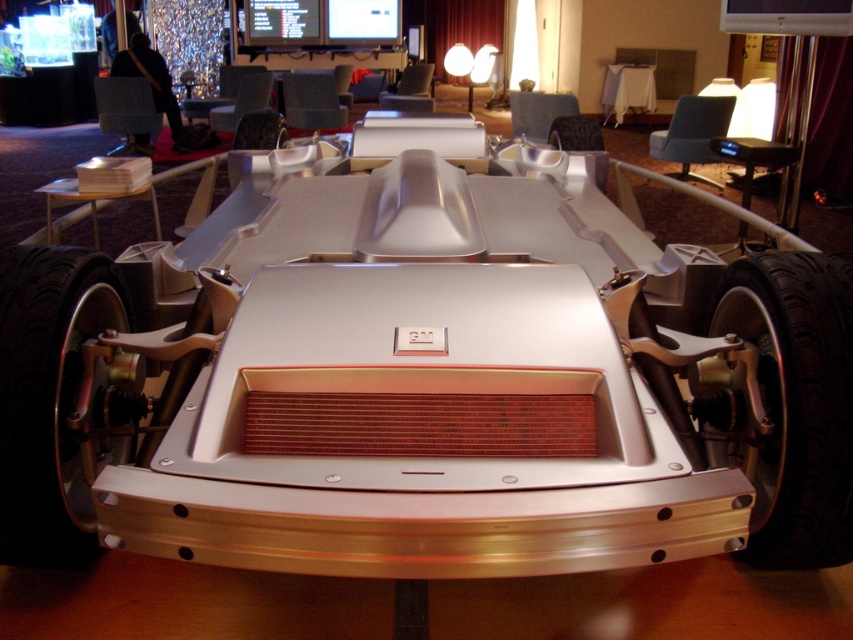
You are standing in front of a futuristic concept car at an exhibition. You notice two points marked on the car. One is at coordinates point (434, 426) and the other at point (10, 326). Which of these points is nearer to you?

Point (434, 426) is closer to the viewer than point (10, 326).

You are a mechanic inspecting the futuristic vehicle. You notice the black rubber tire at lower right and the polished silver wheel at lower left. Which object is located higher from the ground?

The black rubber tire at lower right is positioned over the polished silver wheel at lower left, meaning it is higher from the ground.

You are standing in the showroom and want to take a photo of the metallic silver car at center without the polished silver wheel at lower left appearing in the frame. How should you adjust your position?

Move forward closer to the metallic silver car at center so it blocks the view of the polished silver wheel at lower left behind it.